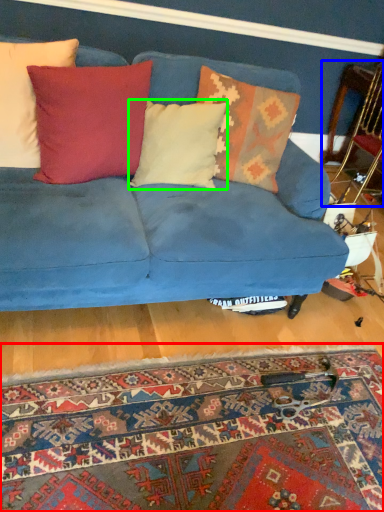
Question: Considering the real-world distances, which object is farthest from mat (highlighted by a red box)? armchair (highlighted by a blue box) or pillow (highlighted by a green box)?

Choices:
 (A) armchair
 (B) pillow

Answer: (A)